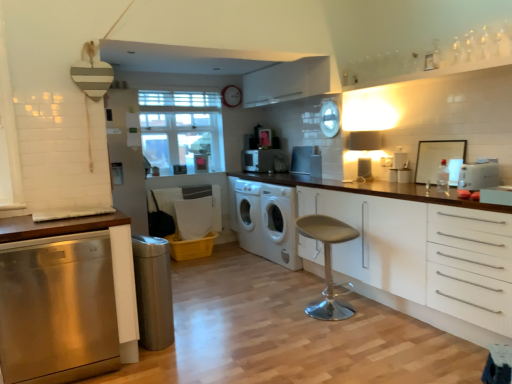
Where is `white matte cabinet at right, marked as the first cabinetry in a right-to-left arrangement`? This screenshot has width=512, height=384. white matte cabinet at right, marked as the first cabinetry in a right-to-left arrangement is located at coordinates (418, 252).

What are the coordinates of `white matte washing machine at center, positioned as the first washing machine in back-to-front order` in the screenshot? It's located at (249, 215).

Describe the element at coordinates (306, 161) in the screenshot. The width and height of the screenshot is (512, 384). I see `satin silver toaster at center, which is the 3th appliance in right-to-left order` at that location.

In order to face beige fabric stool at center, should I rotate leftwards or rightwards?

Rotate your view right by about 9.435°.

From the picture: In order to face stainless steel dishwasher at left, arranged as the first cabinetry when viewed from the left, should I rotate leftwards or rightwards?

It's best to rotate left around 25.146 degrees.

What is the approximate width of stainless steel dishwasher at left, which appears as the second cabinetry when viewed from the right?

stainless steel dishwasher at left, which appears as the second cabinetry when viewed from the right, is 61.13 centimeters wide.

Identify the location of white matte cabinet at right, the 2th cabinetry positioned from the left. (418, 252).

At what (x,y) coordinates should I click in order to perform the action: click on the 1st cabinetry above the satin silver trash can at lower left, the 5th appliance viewed from the back (from the image's perspective). Please return your answer as a coordinate pair (x, y). Image resolution: width=512 pixels, height=384 pixels. Looking at the image, I should click on (112, 264).

How many degrees apart are the facing directions of stainless steel dishwasher at left, which appears as the second cabinetry when viewed from the right, and satin silver trash can at lower left, which ranks as the 1th appliance in left-to-right order?

There is a 96.3-degree angle between the facing directions of stainless steel dishwasher at left, which appears as the second cabinetry when viewed from the right, and satin silver trash can at lower left, which ranks as the 1th appliance in left-to-right order.

From a real-world perspective, does stainless steel dishwasher at left, which appears as the second cabinetry when viewed from the right, sit lower than satin silver trash can at lower left, which is the 1th appliance from bottom to top?

No, from a real-world perspective, stainless steel dishwasher at left, which appears as the second cabinetry when viewed from the right, is not under satin silver trash can at lower left, which is the 1th appliance from bottom to top.

From the image's perspective, is stainless steel dishwasher at left, which appears as the second cabinetry when viewed from the right, beneath satin silver trash can at lower left, arranged as the 5th appliance when viewed from the right?

Incorrect, from the image's perspective, stainless steel dishwasher at left, which appears as the second cabinetry when viewed from the right, is higher than satin silver trash can at lower left, arranged as the 5th appliance when viewed from the right.

Measure the distance from stainless steel dishwasher at left, arranged as the first cabinetry when viewed from the left, to clear glass window at center.

stainless steel dishwasher at left, arranged as the first cabinetry when viewed from the left, is 2.84 meters from clear glass window at center.

Visually, is stainless steel dishwasher at left, which appears as the second cabinetry when viewed from the right, positioned to the left or to the right of clear glass window at center?

In the image, stainless steel dishwasher at left, which appears as the second cabinetry when viewed from the right, appears on the left side of clear glass window at center.

Is point (30, 223) closer or farther from the camera than point (191, 152)?

Clearly, point (30, 223) is closer to the camera than point (191, 152).

Does stainless steel dishwasher at left, which appears as the second cabinetry when viewed from the right, lie in front of clear glass window at center?

Yes, stainless steel dishwasher at left, which appears as the second cabinetry when viewed from the right, is in front of clear glass window at center.

Does white matte cabinet at right, the 2th cabinetry positioned from the left, have a smaller size compared to white matte washing machine at center, the 2th washing machine in the back-to-front sequence?

Actually, white matte cabinet at right, the 2th cabinetry positioned from the left, might be larger than white matte washing machine at center, the 2th washing machine in the back-to-front sequence.

Does point (415, 295) appear closer or farther from the camera than point (284, 235)?

Point (415, 295) is positioned closer to the camera compared to point (284, 235).

Choose the correct answer: Is white matte cabinet at right, the 2th cabinetry positioned from the left, inside white matte washing machine at center, which is the 1th washing machine in front-to-back order, or outside it?

white matte cabinet at right, the 2th cabinetry positioned from the left, cannot be found inside white matte washing machine at center, which is the 1th washing machine in front-to-back order.

Considering the sizes of white matte cabinet at right, marked as the first cabinetry in a right-to-left arrangement, and white matte washing machine at center, the 2th washing machine in the back-to-front sequence, in the image, is white matte cabinet at right, marked as the first cabinetry in a right-to-left arrangement, taller or shorter than white matte washing machine at center, the 2th washing machine in the back-to-front sequence,?

Clearly, white matte cabinet at right, marked as the first cabinetry in a right-to-left arrangement, is shorter compared to white matte washing machine at center, the 2th washing machine in the back-to-front sequence.

Is white glossy microwave at center, the 1th appliance when ordered from back to front, thinner than beige fabric stool at center?

Yes, white glossy microwave at center, the 1th appliance when ordered from back to front, is thinner than beige fabric stool at center.

Does white glossy microwave at center, which is the 4th appliance from right to left, touch beige fabric stool at center?

white glossy microwave at center, which is the 4th appliance from right to left, is not next to beige fabric stool at center, and they're not touching.

Is white glossy microwave at center, the second appliance when ordered from left to right, taller than beige fabric stool at center?

No.

Consider the image. Is white matte cabinet at right, marked as the first cabinetry in a right-to-left arrangement, located outside beige fabric stool at center?

Absolutely, white matte cabinet at right, marked as the first cabinetry in a right-to-left arrangement, is external to beige fabric stool at center.

Is white matte cabinet at right, marked as the first cabinetry in a right-to-left arrangement, in front of beige fabric stool at center?

That is True.

Is white matte cabinet at right, marked as the first cabinetry in a right-to-left arrangement, oriented towards beige fabric stool at center?

Yes, white matte cabinet at right, marked as the first cabinetry in a right-to-left arrangement, faces towards beige fabric stool at center.

Between white matte cabinet at right, the 2th cabinetry positioned from the left, and beige fabric stool at center, which one has more height?

With more height is white matte cabinet at right, the 2th cabinetry positioned from the left.

Is point (183, 108) farther from camera compared to point (319, 170)?

Yes, point (183, 108) is farther from viewer.

Measure the distance between clear glass window at center and satin silver toaster at center, the second appliance from the top.

A distance of 4.59 feet exists between clear glass window at center and satin silver toaster at center, the second appliance from the top.

Is clear glass window at center shorter than satin silver toaster at center, which is the 3th appliance in right-to-left order?

In fact, clear glass window at center may be taller than satin silver toaster at center, which is the 3th appliance in right-to-left order.

Looking at this image, considering the relative positions of clear glass window at center and satin silver toaster at center, the 4th appliance from the front, in the image provided, is clear glass window at center to the right of satin silver toaster at center, the 4th appliance from the front, from the viewer's perspective?

Incorrect, clear glass window at center is not on the right side of satin silver toaster at center, the 4th appliance from the front.

From the picture: What's the angular difference between white plastic toaster at right, the second appliance viewed from the front, and white matte washing machine at center, positioned as the first washing machine in back-to-front order,'s facing directions?

2.22 degrees.

Can you confirm if white plastic toaster at right, which is counted as the 5th appliance, starting from the left, is smaller than white matte washing machine at center, positioned as the first washing machine in back-to-front order?

Indeed, white plastic toaster at right, which is counted as the 5th appliance, starting from the left, has a smaller size compared to white matte washing machine at center, positioned as the first washing machine in back-to-front order.

Is white plastic toaster at right, the 1th appliance viewed from the right, next to white matte washing machine at center, positioned as the first washing machine in back-to-front order?

white plastic toaster at right, the 1th appliance viewed from the right, and white matte washing machine at center, positioned as the first washing machine in back-to-front order, are not in contact.

What are the coordinates of `the 1st appliance to the right of the stainless steel dishwasher at left, arranged as the first cabinetry when viewed from the left, starting your count from the anchor` in the screenshot? It's located at (153, 291).

You are a GUI agent. You are given a task and a screenshot of the screen. Output one action in this format:
    pyautogui.click(x=<x>, y=<y>)
    Task: Click on the cabinetry on the left of clear glass window at center
    This screenshot has height=384, width=512.
    Given the screenshot: What is the action you would take?
    pyautogui.click(x=112, y=264)

Based on their spatial positions, is clear glass window at center or white glossy microwave at center, which is counted as the first appliance, starting from the top, further from white plastic toaster at right, the 1th appliance viewed from the right?

clear glass window at center is positioned further to the anchor white plastic toaster at right, the 1th appliance viewed from the right.

When comparing their distances from white plastic toaster at right, the second appliance viewed from the front, does beige fabric stool at center or white matte washing machine at center, the 2th washing machine in the back-to-front sequence, seem closer?

beige fabric stool at center.

Considering their positions, is white matte washing machine at center, which is the 1th washing machine in front-to-back order, positioned further to stainless steel dishwasher at left, arranged as the first cabinetry when viewed from the left, than white glossy toaster at upper right, positioned as the 3th appliance in top-to-bottom order?

Among the two, white glossy toaster at upper right, positioned as the 3th appliance in top-to-bottom order, is located further to stainless steel dishwasher at left, arranged as the first cabinetry when viewed from the left.

Based on their spatial positions, is clear glass window at center or satin silver toaster at center, arranged as the second appliance when viewed from the back, closer to stainless steel dishwasher at left, which appears as the second cabinetry when viewed from the right?

Among the two, satin silver toaster at center, arranged as the second appliance when viewed from the back, is located nearer to stainless steel dishwasher at left, which appears as the second cabinetry when viewed from the right.

Considering their positions, is beige fabric stool at center positioned closer to white plastic toaster at right, which is counted as the 5th appliance, starting from the left, than clear glass window at center?

Among the two, beige fabric stool at center is located nearer to white plastic toaster at right, which is counted as the 5th appliance, starting from the left.

Estimate the real-world distances between objects in this image. Which object is closer to white glossy toaster at upper right, positioned as the 3th appliance in top-to-bottom order, stainless steel dishwasher at left, arranged as the first cabinetry when viewed from the left, or white matte cabinet at right, the 2th cabinetry positioned from the left?

The object closer to white glossy toaster at upper right, positioned as the 3th appliance in top-to-bottom order, is white matte cabinet at right, the 2th cabinetry positioned from the left.

From the image, which object appears to be farther from white glossy toaster at upper right, positioned as the 3th appliance in top-to-bottom order, satin silver toaster at center, the second appliance from the top, or white matte washing machine at center, which is the 1th washing machine in front-to-back order?

Based on the image, white matte washing machine at center, which is the 1th washing machine in front-to-back order, appears to be further to white glossy toaster at upper right, positioned as the 3th appliance in top-to-bottom order.

From the picture: Which object lies further to the anchor point beige fabric stool at center, white matte washing machine at center, the 2th washing machine viewed from the front, or white matte washing machine at center, the 2th washing machine in the back-to-front sequence?

white matte washing machine at center, the 2th washing machine viewed from the front.

Where is `washing machine located between clear glass window at center and white glossy microwave at center, acting as the fifth appliance starting from the bottom, in the left-right direction`? This screenshot has width=512, height=384. washing machine located between clear glass window at center and white glossy microwave at center, acting as the fifth appliance starting from the bottom, in the left-right direction is located at coordinates (249, 215).

This screenshot has width=512, height=384. I want to click on appliance between beige fabric stool at center and white matte washing machine at center, which is the 1th washing machine in front-to-back order, from front to back, so click(400, 160).

Locate an element on the screen. The height and width of the screenshot is (384, 512). bar stool between stainless steel dishwasher at left, which appears as the second cabinetry when viewed from the right, and clear glass window at center from front to back is located at coordinates (327, 263).

You are a GUI agent. You are given a task and a screenshot of the screen. Output one action in this format:
    pyautogui.click(x=<x>, y=<y>)
    Task: Click on the washing machine between satin silver trash can at lower left, which is the fifth appliance in top-to-bottom order, and clear glass window at center from front to back
    
    Given the screenshot: What is the action you would take?
    pyautogui.click(x=267, y=220)